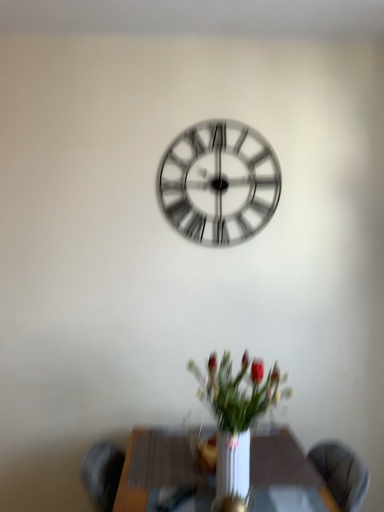
Question: Are white glossy vase at center and wooden table at center beside each other?

Choices:
 (A) no
 (B) yes

Answer: (A)

Question: Does white glossy vase at center have a smaller size compared to wooden table at center?

Choices:
 (A) no
 (B) yes

Answer: (B)

Question: Is white glossy vase at center wider than wooden table at center?

Choices:
 (A) yes
 (B) no

Answer: (B)

Question: Is white glossy vase at center further to the viewer compared to wooden table at center?

Choices:
 (A) yes
 (B) no

Answer: (B)

Question: From the image's perspective, is white glossy vase at center below wooden table at center?

Choices:
 (A) no
 (B) yes

Answer: (A)

Question: Is metallic silver clock at center wider or thinner than wooden table at center?

Choices:
 (A) wide
 (B) thin

Answer: (B)

Question: Is point (276, 193) closer or farther from the camera than point (326, 507)?

Choices:
 (A) closer
 (B) farther

Answer: (B)

Question: From the image's perspective, is metallic silver clock at center positioned above or below wooden table at center?

Choices:
 (A) above
 (B) below

Answer: (A)

Question: Looking at the image, does metallic silver clock at center seem bigger or smaller compared to wooden table at center?

Choices:
 (A) big
 (B) small

Answer: (B)

Question: From the image's perspective, relative to white glossy vase at center, is wooden table at center above or below?

Choices:
 (A) below
 (B) above

Answer: (A)

Question: Is wooden table at center inside the boundaries of white glossy vase at center, or outside?

Choices:
 (A) outside
 (B) inside

Answer: (A)

Question: Does point (317, 483) appear closer or farther from the camera than point (278, 393)?

Choices:
 (A) farther
 (B) closer

Answer: (B)

Question: Considering the positions of wooden table at center and white glossy vase at center in the image, is wooden table at center taller or shorter than white glossy vase at center?

Choices:
 (A) short
 (B) tall

Answer: (A)

Question: Considering the relative positions of white glossy vase at center and wooden table at center in the image provided, is white glossy vase at center to the left or to the right of wooden table at center?

Choices:
 (A) left
 (B) right

Answer: (B)

Question: In terms of height, does white glossy vase at center look taller or shorter compared to wooden table at center?

Choices:
 (A) short
 (B) tall

Answer: (B)